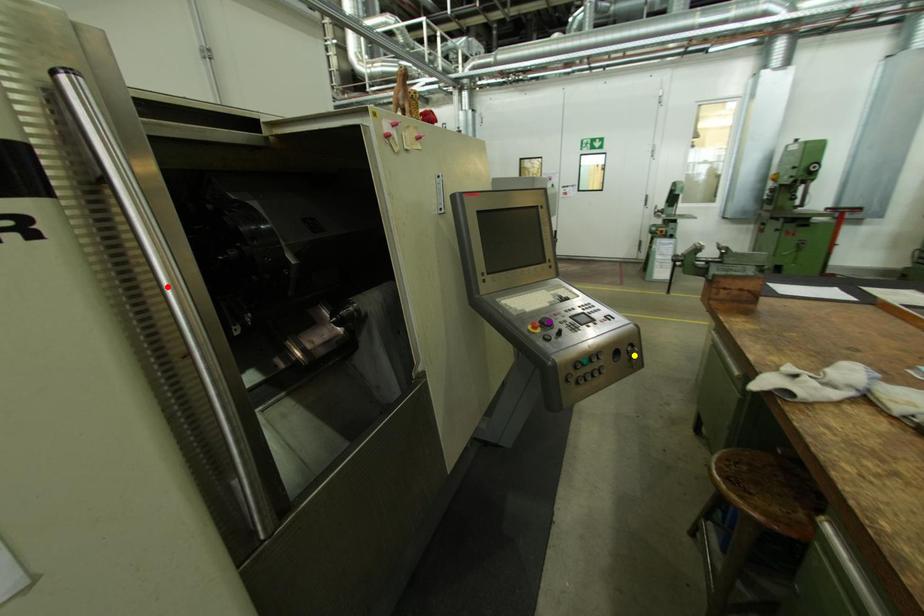
In the scene shown: Order these from farthest to nearest:
- yellow point
- purple point
- red point

purple point → yellow point → red point